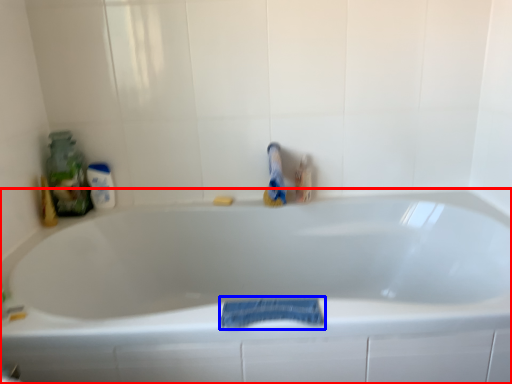
Question: Which point is further to the camera, bathtub (highlighted by a red box) or bath towel (highlighted by a blue box)?

Choices:
 (A) bathtub
 (B) bath towel

Answer: (B)